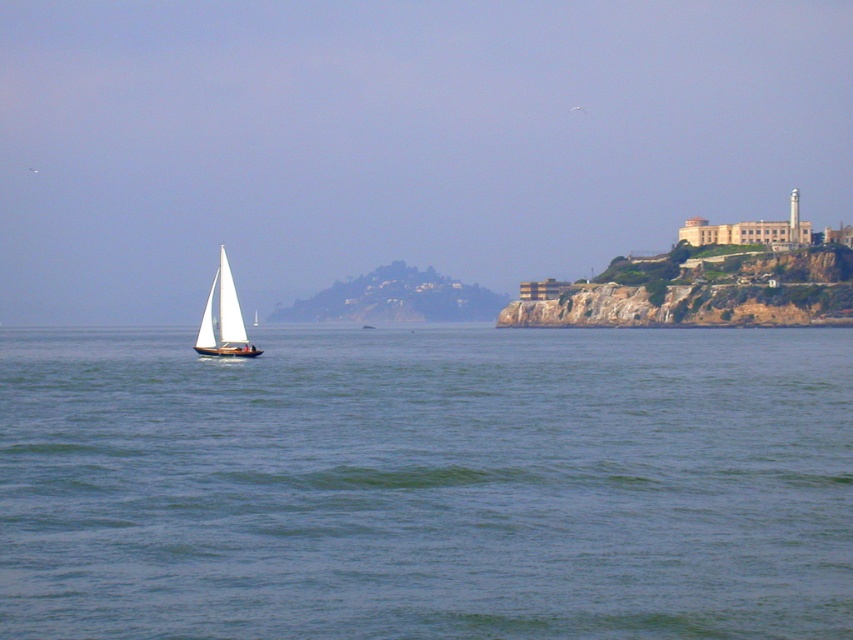
Which is above, green water at center or white matte sailboat at left?

white matte sailboat at left is higher up.

Who is shorter, green water at center or white matte sailboat at left?

Standing shorter between the two is green water at center.

Between point (132, 422) and point (254, 353), which one is positioned in front?

Positioned in front is point (132, 422).

At what (x,y) coordinates should I click in order to perform the action: click on green water at center. Please return your answer as a coordinate pair (x, y). The image size is (853, 640). Looking at the image, I should click on (427, 483).